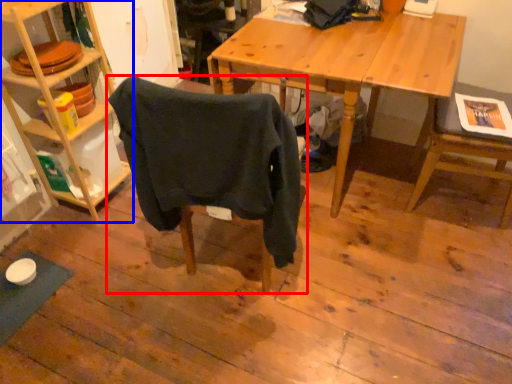
Question: Among these objects, which one is farthest to the camera, chair (highlighted by a red box) or shelf (highlighted by a blue box)?

Choices:
 (A) chair
 (B) shelf

Answer: (B)